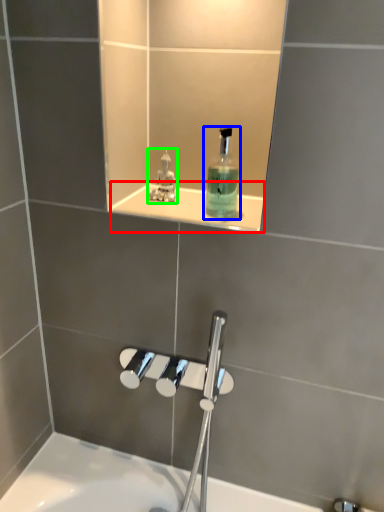
Question: Considering the real-world distances, which object is farthest from ledge (highlighted by a red box)? mouthwash (highlighted by a blue box) or perfume (highlighted by a green box)?

Choices:
 (A) mouthwash
 (B) perfume

Answer: (B)